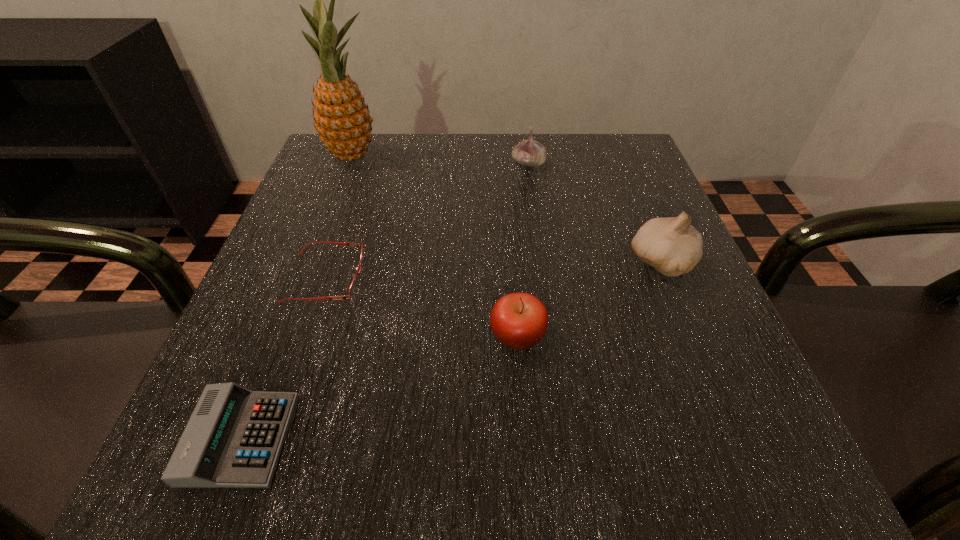
Identify the location of free region located on the back of the left garlic. This screenshot has height=540, width=960. (525, 142).

Locate an element on the screen. This screenshot has width=960, height=540. free space located on the back of the apple is located at coordinates (514, 277).

You are a GUI agent. You are given a task and a screenshot of the screen. Output one action in this format:
    pyautogui.click(x=<x>, y=<y>)
    Task: Click on the free space located on the lenses of the spectacles
    Image resolution: width=960 pixels, height=540 pixels.
    Given the screenshot: What is the action you would take?
    pyautogui.click(x=453, y=278)

The image size is (960, 540). Identify the location of vacant space located on the back of the calculator. click(x=312, y=252).

I want to click on pineapple that is at the far edge, so click(342, 119).

Identify the location of garlic that is at the far edge. (529, 152).

In order to click on object situated at the near edge in this screenshot , I will do `click(233, 439)`.

Image resolution: width=960 pixels, height=540 pixels. Find the location of `pineapple that is at the left edge`. pineapple that is at the left edge is located at coordinates (342, 119).

You are a GUI agent. You are given a task and a screenshot of the screen. Output one action in this format:
    pyautogui.click(x=<x>, y=<y>)
    Task: Click on the spectacles positioned at the left edge
    The height and width of the screenshot is (540, 960).
    Given the screenshot: What is the action you would take?
    pyautogui.click(x=352, y=290)

Locate an element on the screen. calculator that is positioned at the left edge is located at coordinates (233, 439).